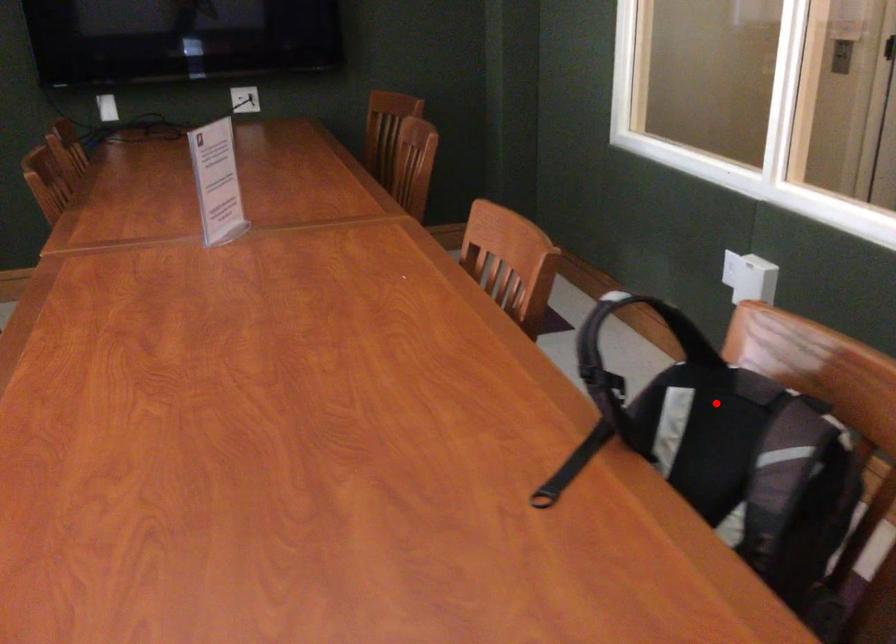
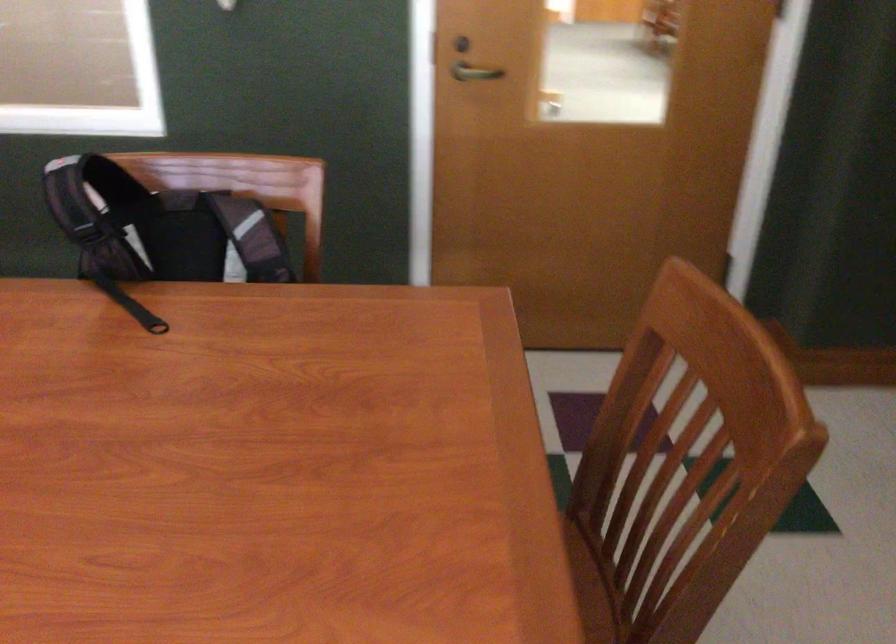
Find the pixel in the second image that matches the highlighted location in the first image.

(159, 228)